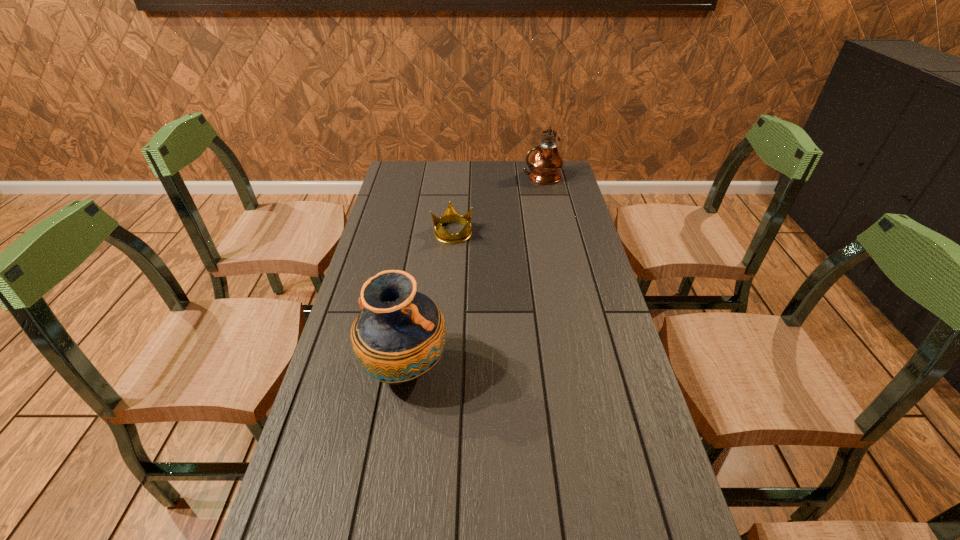
The image size is (960, 540). I want to click on oil lamp, so click(545, 165).

This screenshot has width=960, height=540. What are the coordinates of `the tallest object` in the screenshot? It's located at pyautogui.click(x=545, y=165).

At what (x,y) coordinates should I click in order to perform the action: click on the nearest object. Please return your answer as a coordinate pair (x, y). This screenshot has width=960, height=540. Looking at the image, I should click on (399, 335).

Where is `pottery`? The image size is (960, 540). pottery is located at coordinates (399, 335).

Locate an element on the screen. The width and height of the screenshot is (960, 540). the second nearest object is located at coordinates (450, 216).

Where is `crown`? crown is located at coordinates (450, 216).

The image size is (960, 540). I want to click on vacant space located on the front of the rightmost object, so click(x=549, y=212).

Find the location of a particular element. The width and height of the screenshot is (960, 540). free region located on the right of the nearest object is located at coordinates (566, 369).

This screenshot has height=540, width=960. I want to click on vacant space located on the front of the crown, so click(x=450, y=256).

Find the location of a particular element. The height and width of the screenshot is (540, 960). object present at the far edge is located at coordinates (545, 165).